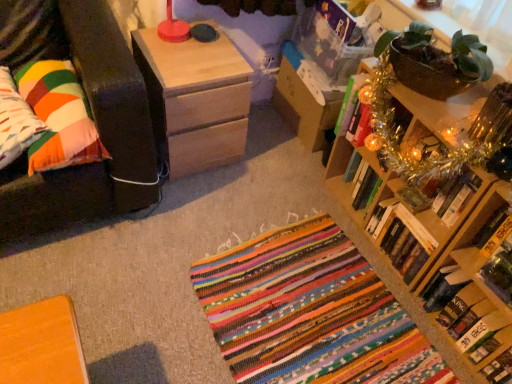
You are a GUI agent. You are given a task and a screenshot of the screen. Output one action in this format:
    pyautogui.click(x=<x>, y=<y>)
    Task: Click on the vacant space in between natural wood nightstand at upper left and multicolored woven rug at center
    This screenshot has height=384, width=512.
    Given the screenshot: What is the action you would take?
    pyautogui.click(x=233, y=200)